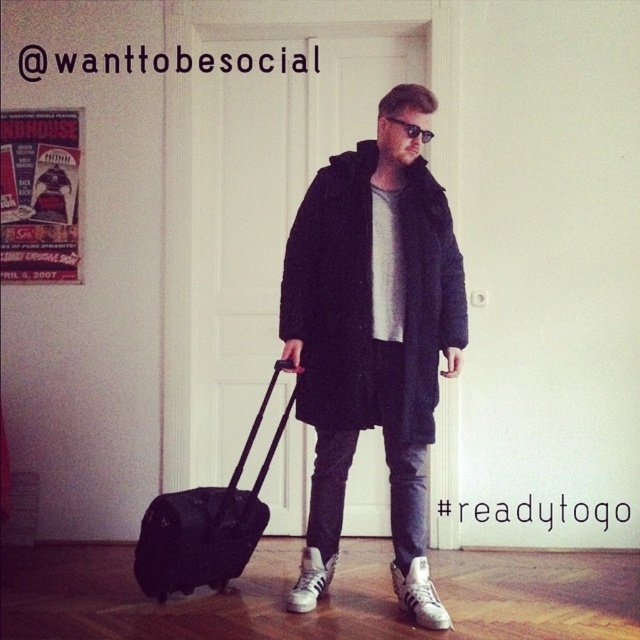
Question: Among these objects, which one is nearest to the camera?

Choices:
 (A) black woolen coat at center
 (B) black fabric suitcase at lower left

Answer: (A)

Question: Is the position of black woolen coat at center less distant than that of black fabric suitcase at lower left?

Choices:
 (A) no
 (B) yes

Answer: (B)

Question: Estimate the real-world distances between objects in this image. Which object is closer to the black plastic sunglasses at center?

Choices:
 (A) black woolen coat at center
 (B) black fabric suitcase at lower left

Answer: (A)

Question: Which of the following is the farthest from the observer?

Choices:
 (A) black woolen coat at center
 (B) black plastic sunglasses at center
 (C) black fabric suitcase at lower left

Answer: (C)

Question: Is black fabric suitcase at lower left further to the viewer compared to black plastic sunglasses at center?

Choices:
 (A) yes
 (B) no

Answer: (A)

Question: Does black woolen coat at center lie behind black fabric suitcase at lower left?

Choices:
 (A) yes
 (B) no

Answer: (B)